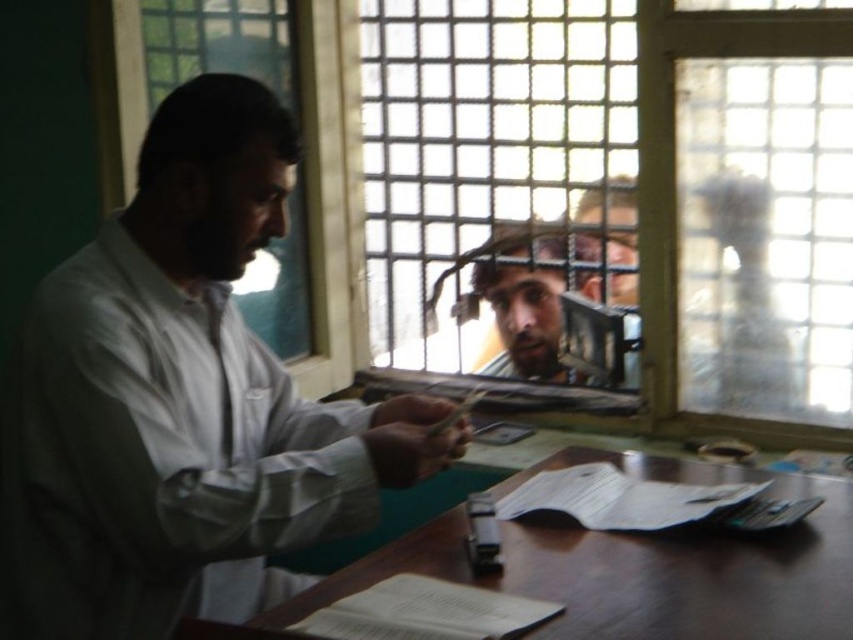
Question: Which of the following is the farthest from the observer?

Choices:
 (A) (604, 108)
 (B) (50, 308)

Answer: (A)

Question: Is clear glass window at center thinner than wooden table at center?

Choices:
 (A) yes
 (B) no

Answer: (B)

Question: Is clear glass window at center below wooden table at center?

Choices:
 (A) yes
 (B) no

Answer: (B)

Question: Which point appears closest to the camera in this image?

Choices:
 (A) (527, 563)
 (B) (180, 336)
 (C) (636, 26)

Answer: (B)

Question: Does white matte shirt at center have a smaller size compared to wooden table at center?

Choices:
 (A) yes
 (B) no

Answer: (B)

Question: Which point appears farthest from the camera in this image?

Choices:
 (A) (73, 260)
 (B) (849, 580)
 (C) (776, 72)

Answer: (C)